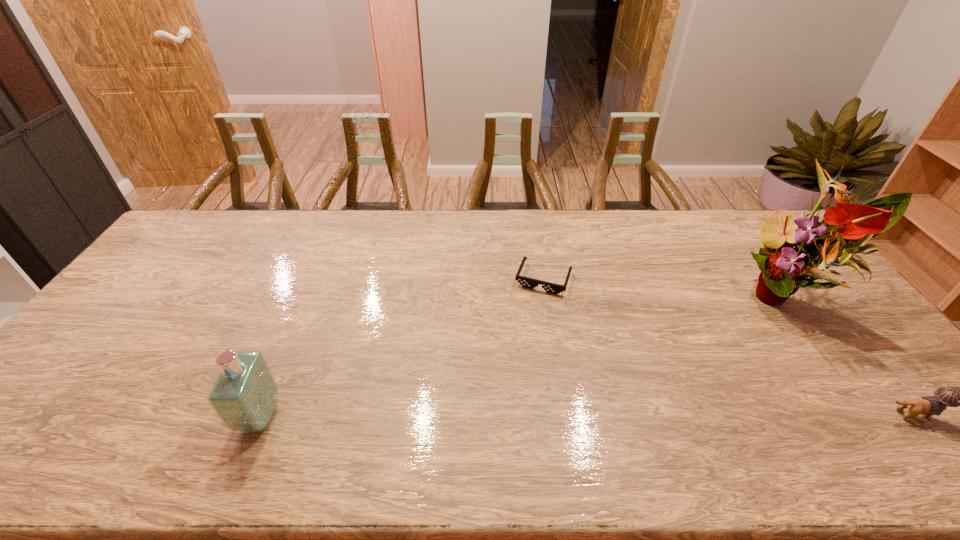
The height and width of the screenshot is (540, 960). I want to click on vacant space located on the front-facing side of the tallest object, so click(756, 343).

You are a GUI agent. You are given a task and a screenshot of the screen. Output one action in this format:
    pyautogui.click(x=<x>, y=<y>)
    Task: Click on the vacant space located on the front-facing side of the tallest object
    
    Given the screenshot: What is the action you would take?
    pyautogui.click(x=759, y=340)

In order to click on vacant area situated on the front-facing side of the tallest object in this screenshot , I will do `click(747, 353)`.

Locate an element on the screen. perfume at the near edge is located at coordinates (244, 396).

Where is `kitten located in the near edge section of the desktop`? kitten located in the near edge section of the desktop is located at coordinates (948, 396).

This screenshot has height=540, width=960. I want to click on kitten located in the right edge section of the desktop, so click(x=948, y=396).

At what (x,y) coordinates should I click in order to perform the action: click on bouquet positioned at the right edge. Please return your answer as a coordinate pair (x, y). The width and height of the screenshot is (960, 540). Looking at the image, I should click on (845, 229).

Image resolution: width=960 pixels, height=540 pixels. Identify the location of object located in the near right corner section of the desktop. (948, 396).

Where is `free space at the far edge of the desktop`? Image resolution: width=960 pixels, height=540 pixels. free space at the far edge of the desktop is located at coordinates (479, 226).

In the image, there is a desktop. Where is `free space at the near edge`? The width and height of the screenshot is (960, 540). free space at the near edge is located at coordinates (573, 421).